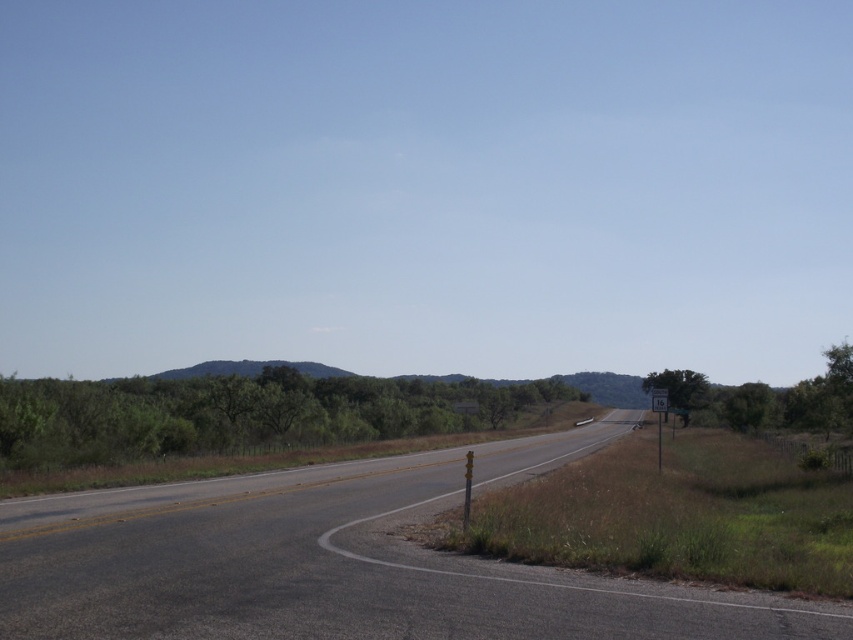
Question: From the image, what is the correct spatial relationship of white plastic sign at right in relation to yellow metal speed limit sign at right?

Choices:
 (A) left
 (B) right

Answer: (B)

Question: Which point is farther to the camera?

Choices:
 (A) asphalt road at center
 (B) white plastic sign at right
 (C) green leafy trees at center

Answer: (B)

Question: Which point is closer to the camera?

Choices:
 (A) (651, 396)
 (B) (646, 390)
 (C) (660, 458)

Answer: (C)

Question: Can you confirm if asphalt road at center is positioned above white plastic sign at right?

Choices:
 (A) no
 (B) yes

Answer: (B)

Question: Which point is closer to the camera?

Choices:
 (A) (444, 432)
 (B) (404, 500)
 (C) (660, 396)
 (D) (662, 376)

Answer: (B)

Question: Is green leafy tree at right above yellow metal speed limit sign at right?

Choices:
 (A) no
 (B) yes

Answer: (A)